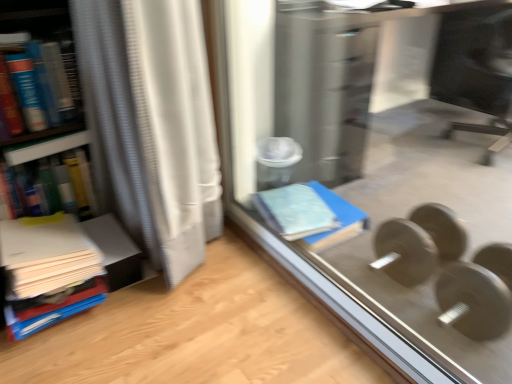
Question: In the image, is white textured curtain at left positioned in front of or behind matte plastic book at left, the 2th book ordered from the bottom?

Choices:
 (A) front
 (B) behind

Answer: (A)

Question: Based on their sizes in the image, would you say white textured curtain at left is bigger or smaller than matte plastic book at left, the second book from the top?

Choices:
 (A) big
 (B) small

Answer: (A)

Question: Which object is positioned closest to the white textured curtain at left?

Choices:
 (A) metallic gray dumbbell at lower right, the first dumbbell in the back-to-front sequence
 (B) white matte paper stack at left, positioned as the third book in top-to-bottom order
 (C) black glossy monitor at upper right
 (D) matte gray dumbbell at lower right, arranged as the 2th dumbbell when viewed from the back
 (E) matte plastic book at left, the 2th book ordered from the bottom

Answer: (E)

Question: Which of these objects is positioned farthest from the hardcover book at left, the first book in the top-to-bottom sequence?

Choices:
 (A) transparent glass door at center
 (B) metallic gray dumbbell at lower right, the first dumbbell in the back-to-front sequence
 (C) matte gray dumbbell at lower right, arranged as the 2th dumbbell when viewed from the back
 (D) matte plastic book at left, the 2th book ordered from the bottom
 (E) white textured curtain at left

Answer: (C)